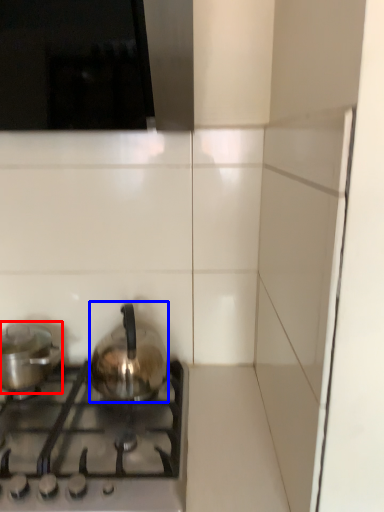
Question: Which point is further to the camera, kitchen appliance (highlighted by a red box) or kitchen appliance (highlighted by a blue box)?

Choices:
 (A) kitchen appliance
 (B) kitchen appliance

Answer: (A)